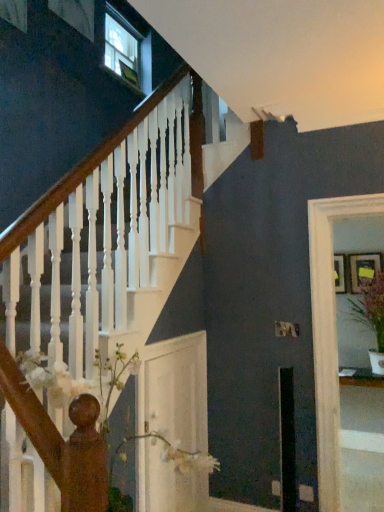
Question: Is wooden picture frame at right, the second picture frame in the right-to-left sequence, wider than wooden picture frame at upper right, the 2th picture frame from the left?

Choices:
 (A) yes
 (B) no

Answer: (B)

Question: From the image's perspective, is wooden picture frame at right, the second picture frame in the right-to-left sequence, located beneath wooden picture frame at upper right, the 2th picture frame from the left?

Choices:
 (A) yes
 (B) no

Answer: (A)

Question: Are wooden picture frame at right, the second picture frame in the right-to-left sequence, and wooden picture frame at upper right, the 1th picture frame from the right, located far from each other?

Choices:
 (A) no
 (B) yes

Answer: (A)

Question: Is wooden picture frame at right, the second picture frame in the right-to-left sequence, to the right of wooden picture frame at upper right, the 1th picture frame from the right, from the viewer's perspective?

Choices:
 (A) no
 (B) yes

Answer: (A)

Question: Is wooden picture frame at right, which appears as the first picture frame when viewed from the left, at the left side of wooden picture frame at upper right, the 2th picture frame from the left?

Choices:
 (A) no
 (B) yes

Answer: (B)

Question: From the image's perspective, is wooden picture frame at upper right, the 2th picture frame from the left, located above or below white glossy door at center, the 2th glass door in the right-to-left sequence?

Choices:
 (A) below
 (B) above

Answer: (B)

Question: Is point (359, 279) positioned closer to the camera than point (205, 488)?

Choices:
 (A) farther
 (B) closer

Answer: (A)

Question: From a real-world perspective, is wooden picture frame at upper right, the 2th picture frame from the left, physically located above or below white glossy door at center, the first glass door when ordered from left to right?

Choices:
 (A) below
 (B) above

Answer: (B)

Question: Based on their positions, is wooden picture frame at upper right, the 2th picture frame from the left, located to the left or right of white glossy door at center, the first glass door when ordered from left to right?

Choices:
 (A) right
 (B) left

Answer: (A)

Question: From the image's perspective, relative to clear glass door at right, the 1th glass door viewed from the right, is wooden picture frame at upper right, the 2th picture frame from the left, above or below?

Choices:
 (A) below
 (B) above

Answer: (B)

Question: Would you say wooden picture frame at upper right, the 1th picture frame from the right, is inside or outside clear glass door at right, the 1th glass door viewed from the right?

Choices:
 (A) inside
 (B) outside

Answer: (B)

Question: Considering the positions of point pos(374,252) and point pos(312,223), is point pos(374,252) closer or farther from the camera than point pos(312,223)?

Choices:
 (A) farther
 (B) closer

Answer: (A)

Question: Is wooden picture frame at upper right, the 1th picture frame from the right, wider or thinner than clear glass door at right, the 1th glass door viewed from the right?

Choices:
 (A) wide
 (B) thin

Answer: (B)

Question: Relative to wooden picture frame at upper right, the 1th picture frame from the right, is wooden picture frame at right, which appears as the first picture frame when viewed from the left, in front or behind?

Choices:
 (A) front
 (B) behind

Answer: (B)

Question: From the image's perspective, is wooden picture frame at right, which appears as the first picture frame when viewed from the left, above or below wooden picture frame at upper right, the 1th picture frame from the right?

Choices:
 (A) above
 (B) below

Answer: (B)